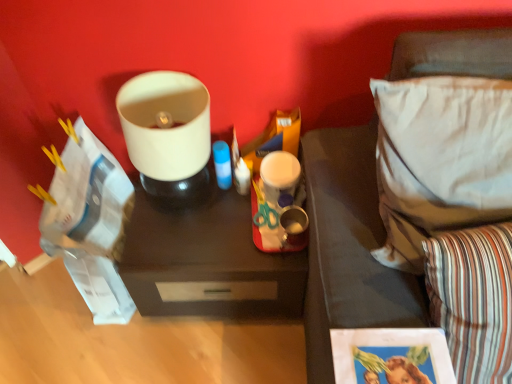
Question: Does matte white lampshade at upper center have a greater height compared to white fabric pillow at right, the first pillow viewed from the top?

Choices:
 (A) yes
 (B) no

Answer: (A)

Question: Does matte white lampshade at upper center appear on the right side of white fabric pillow at right, the first pillow viewed from the top?

Choices:
 (A) no
 (B) yes

Answer: (A)

Question: Can you confirm if matte white lampshade at upper center is shorter than white fabric pillow at right, the 2th pillow in the bottom-to-top sequence?

Choices:
 (A) yes
 (B) no

Answer: (B)

Question: From a real-world perspective, does matte white lampshade at upper center sit lower than white fabric pillow at right, the first pillow viewed from the top?

Choices:
 (A) no
 (B) yes

Answer: (B)

Question: Can you confirm if matte white lampshade at upper center is smaller than white fabric pillow at right, the 2th pillow in the bottom-to-top sequence?

Choices:
 (A) yes
 (B) no

Answer: (A)

Question: Is matte white lampshade at upper center thinner than white fabric pillow at right, the first pillow viewed from the top?

Choices:
 (A) yes
 (B) no

Answer: (A)

Question: Can you confirm if white fabric pillow at right, the first pillow viewed from the top, is taller than striped fabric pillow at lower right, arranged as the 1th pillow when ordered from the bottom?

Choices:
 (A) no
 (B) yes

Answer: (A)

Question: Is white fabric pillow at right, the first pillow viewed from the top, turned away from striped fabric pillow at lower right, arranged as the 1th pillow when ordered from the bottom?

Choices:
 (A) no
 (B) yes

Answer: (A)

Question: Is white fabric pillow at right, the 2th pillow in the bottom-to-top sequence, positioned behind striped fabric pillow at lower right, arranged as the 1th pillow when ordered from the bottom?

Choices:
 (A) no
 (B) yes

Answer: (B)

Question: Are white fabric pillow at right, the first pillow viewed from the top, and striped fabric pillow at lower right, the second pillow in the top-to-bottom sequence, located far from each other?

Choices:
 (A) yes
 (B) no

Answer: (B)

Question: Is white fabric pillow at right, the 2th pillow in the bottom-to-top sequence, to the right of striped fabric pillow at lower right, the second pillow in the top-to-bottom sequence, from the viewer's perspective?

Choices:
 (A) no
 (B) yes

Answer: (A)

Question: From the image's perspective, is white fabric pillow at right, the 2th pillow in the bottom-to-top sequence, located beneath striped fabric pillow at lower right, arranged as the 1th pillow when ordered from the bottom?

Choices:
 (A) no
 (B) yes

Answer: (A)

Question: Would you say matte white lampshade at upper center contains dark wood tray at center?

Choices:
 (A) yes
 (B) no

Answer: (B)